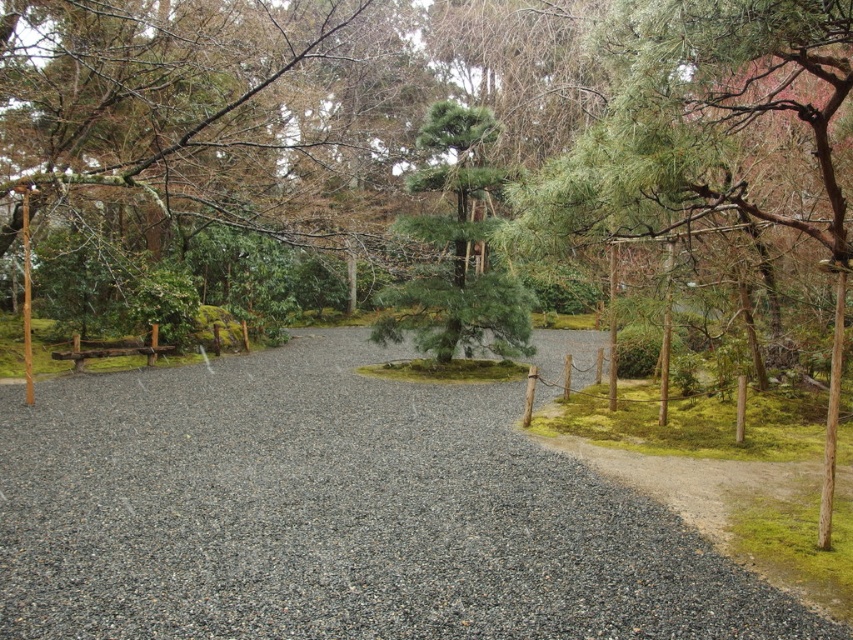
Is green needle-like at upper right smaller than green needle-like at center?

Actually, green needle-like at upper right might be larger than green needle-like at center.

What do you see at coordinates (708, 138) in the screenshot? Image resolution: width=853 pixels, height=640 pixels. I see `green needle-like at upper right` at bounding box center [708, 138].

Between point (775, 77) and point (392, 300), which one is positioned in front?

Positioned in front is point (775, 77).

Find the location of a particular element. This screenshot has height=640, width=853. green needle-like at upper right is located at coordinates (708, 138).

Can you confirm if gray gravel at center is taller than green needle-like at center?

Yes.

Who is more distant from viewer, (239, 460) or (426, 310)?

The point (426, 310) is more distant.

This screenshot has width=853, height=640. What are the coordinates of `gray gravel at center` in the screenshot? It's located at (335, 515).

Who is more forward, (409, 554) or (526, 218)?

Point (526, 218) is in front.

Does gray gravel at center appear on the right side of green needle-like at upper right?

Incorrect, gray gravel at center is not on the right side of green needle-like at upper right.

Does point (270, 385) come closer to viewer compared to point (546, 182)?

No, (270, 385) is behind (546, 182).

This screenshot has height=640, width=853. What are the coordinates of `gray gravel at center` in the screenshot? It's located at (335, 515).